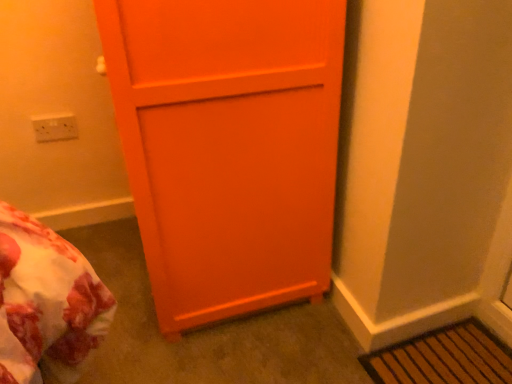
The image size is (512, 384). Identify the location of white plastic electric outlet at upper left. (54, 127).

What do you see at coordinates (54, 127) in the screenshot? I see `white plastic electric outlet at upper left` at bounding box center [54, 127].

Find the location of `white plastic electric outlet at upper left`. white plastic electric outlet at upper left is located at coordinates (54, 127).